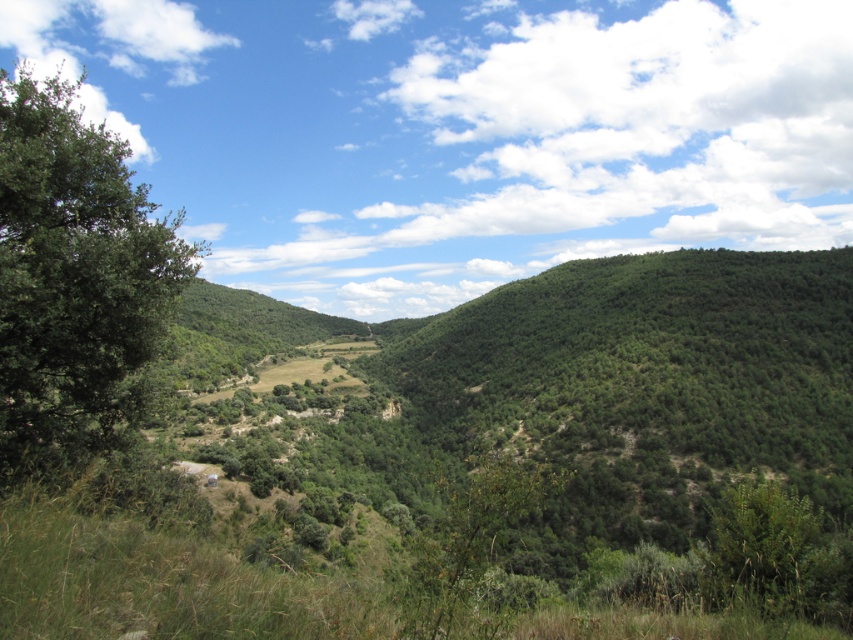
Question: Is green leafy tree at left further to the viewer compared to green leafy shrub at lower right?

Choices:
 (A) no
 (B) yes

Answer: (B)

Question: Based on their relative distances, which object is nearer to the green leafy shrub at center?

Choices:
 (A) green leafy tree at left
 (B) green leafy shrub at lower right

Answer: (B)

Question: Considering the relative positions of green leafy tree at left and green leafy shrub at lower right in the image provided, where is green leafy tree at left located with respect to green leafy shrub at lower right?

Choices:
 (A) left
 (B) right

Answer: (A)

Question: Which point is closer to the camera?

Choices:
 (A) green leafy tree at left
 (B) green leafy shrub at lower right
 (C) green leafy shrub at center

Answer: (C)

Question: Among these objects, which one is farthest from the camera?

Choices:
 (A) green leafy shrub at lower right
 (B) green leafy tree at left

Answer: (B)

Question: Is green leafy tree at left in front of green leafy shrub at center?

Choices:
 (A) no
 (B) yes

Answer: (A)